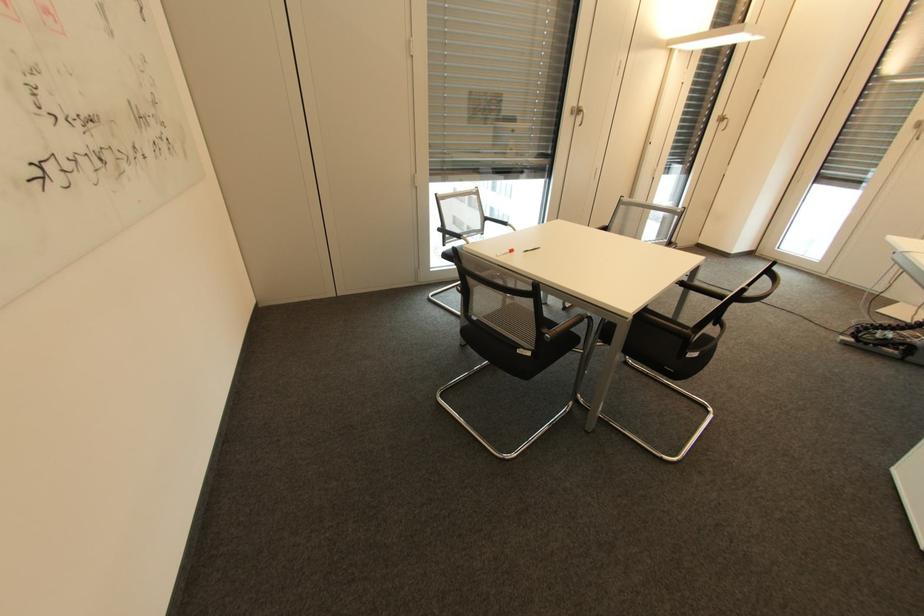
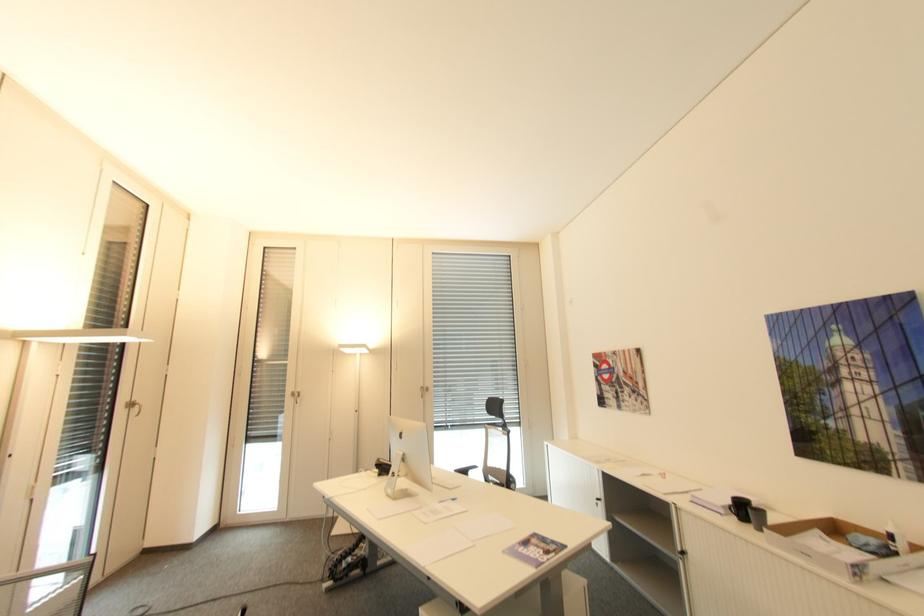
In the second image, find the point that corresponds to point 723,116 in the first image.

(131, 402)